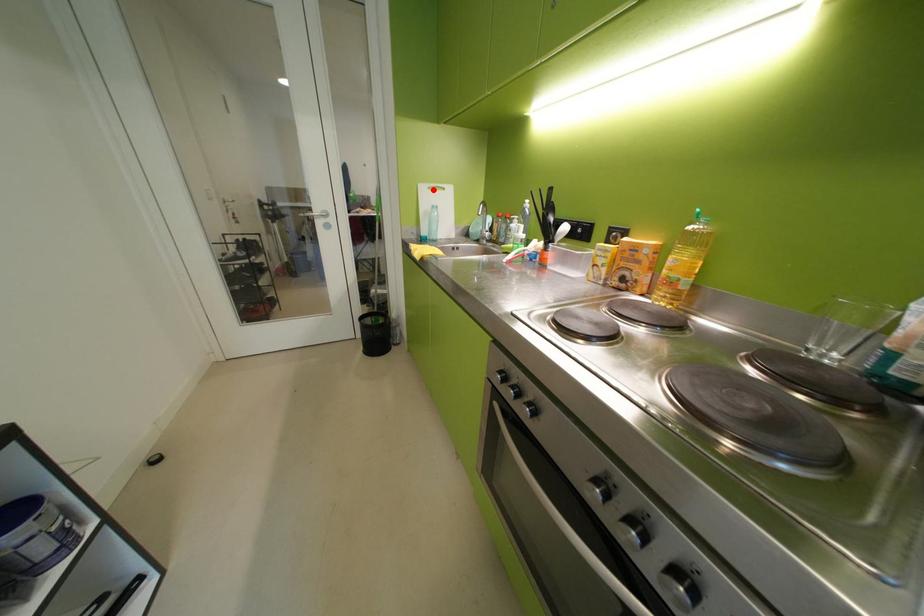
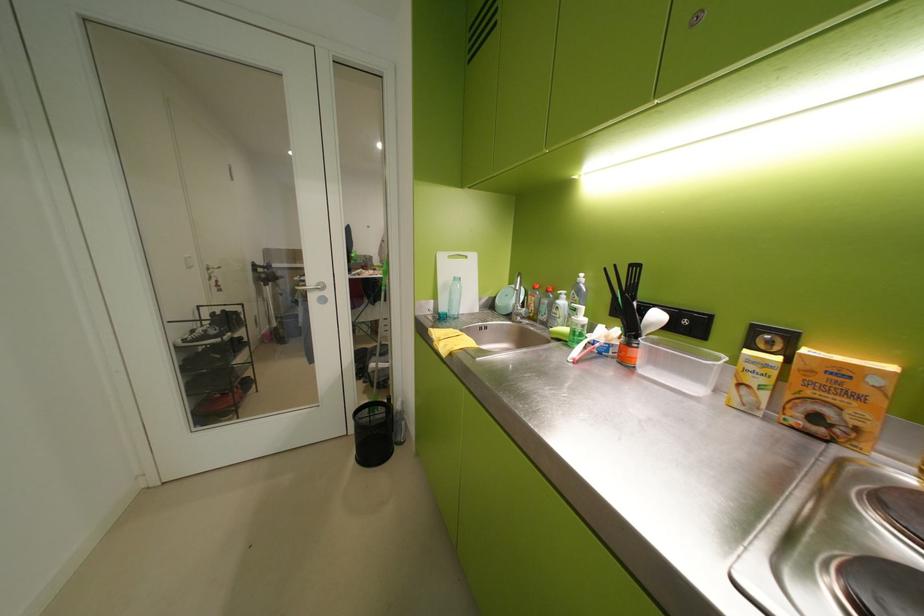
Where in the second image is the point corresponding to the highlighted location from the first image?

(453, 259)